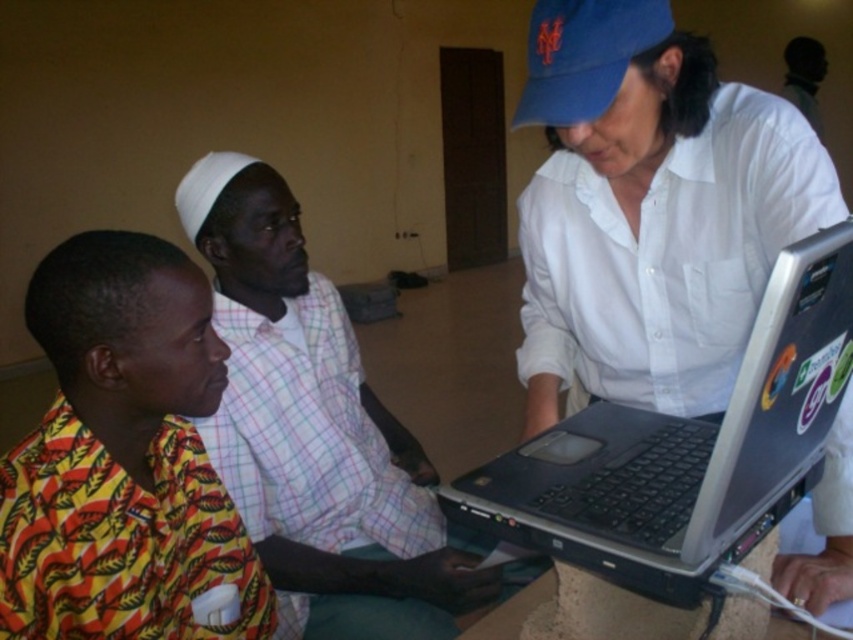
Is silver metallic laptop at center above blue fabric baseball cap at upper center?

Actually, silver metallic laptop at center is below blue fabric baseball cap at upper center.

Is point (750, 381) more distant than point (566, 60)?

No.

Identify the location of silver metallic laptop at center. (686, 449).

From the picture: Which is above, blue fabric baseball cap at upper center or dark skin man at upper right?

dark skin man at upper right is higher up.

Based on the photo, who is taller, blue fabric baseball cap at upper center or dark skin man at upper right?

dark skin man at upper right

Is point (534, 10) positioned after point (799, 65)?

No, (534, 10) is closer to viewer.

I want to click on blue fabric baseball cap at upper center, so click(584, 54).

Can you confirm if plaid fabric shirt at center is thinner than dark skin man at upper right?

No, plaid fabric shirt at center is not thinner than dark skin man at upper right.

Consider the image. Does plaid fabric shirt at center have a greater height compared to dark skin man at upper right?

Indeed, plaid fabric shirt at center has a greater height compared to dark skin man at upper right.

The width and height of the screenshot is (853, 640). I want to click on plaid fabric shirt at center, so click(x=314, y=432).